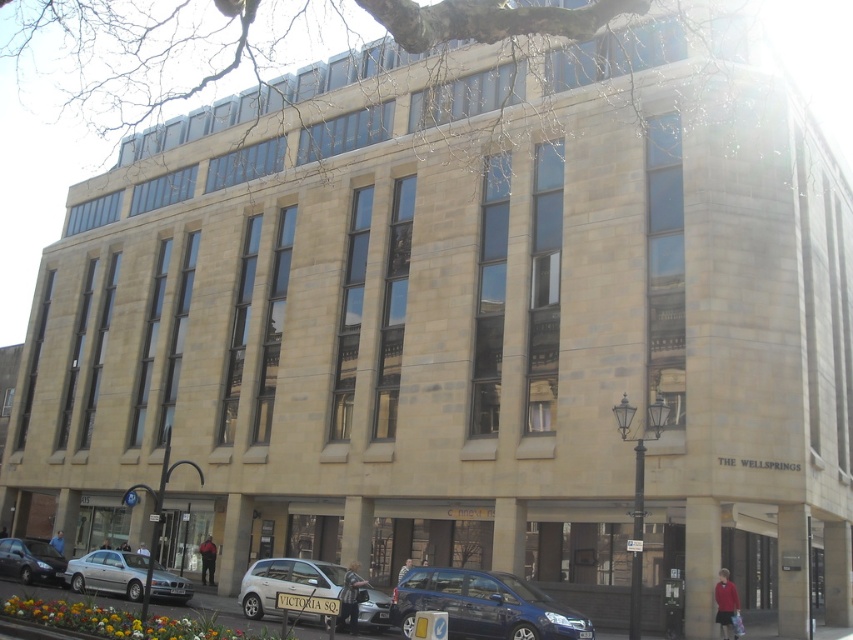
What is the relationship between the sizes of the metallic blue van at lower center and the silver metallic sedan at lower left?

The metallic blue van at lower center is larger in size compared to the silver metallic sedan at lower left.

You are a delivery person who needs to park a 15 feet long delivery truck between the silver metallic hatchback at lower center and the silver metallic sedan at lower left. Is there enough space between them to park the truck?

The distance between the silver metallic hatchback at lower center and the silver metallic sedan at lower left is 22.05 feet. Since the delivery truck is 15 feet long, there is sufficient space to park the truck between them.

You are a delivery driver who needs to back out of the parking spot between the metallic blue van at lower center and the silver metallic hatchback at lower center. Is the space between them wide enough for your vehicle, which is 2 meters wide?

The metallic blue van at lower center is positioned over silver metallic hatchback at lower center, meaning they are parked directly in front of each other rather than side by side. Therefore, there is no lateral space between them for your vehicle to maneuver through. You should look for another parking spot or wait until one of the vehicles leaves.